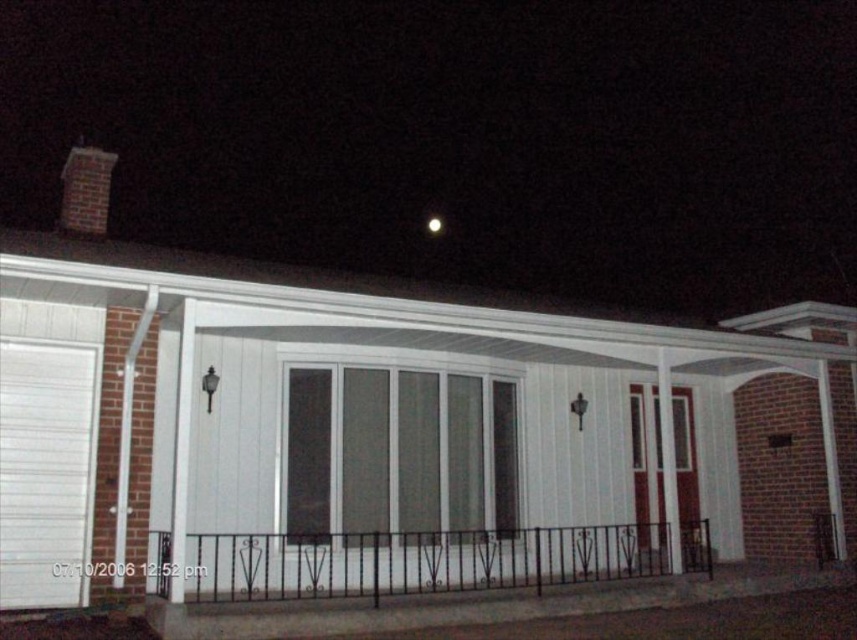
You are a delivery person approaching the house and need to place a package on the porch. The package is too heavy to lift high. Which object between the black wrought iron railing at lower center and the bright white sphere at upper center is easier to reach?

The black wrought iron railing at lower center is easier to reach because it has a larger size compared to the bright white sphere at upper center.

You are standing on the porch of the house and want to compare the height of the black wrought iron railing at lower center and the brick chimney at upper left. Which one is taller?

The brick chimney at upper left is taller than the black wrought iron railing at lower center.

You are standing in front of the house and want to touch both the black wrought iron railing at lower center and the brick chimney at upper left. Which object will you need to reach out further to touch?

The brick chimney at upper left is further away from you than the black wrought iron railing at lower center, so you will need to reach out further to touch the brick chimney at upper left.